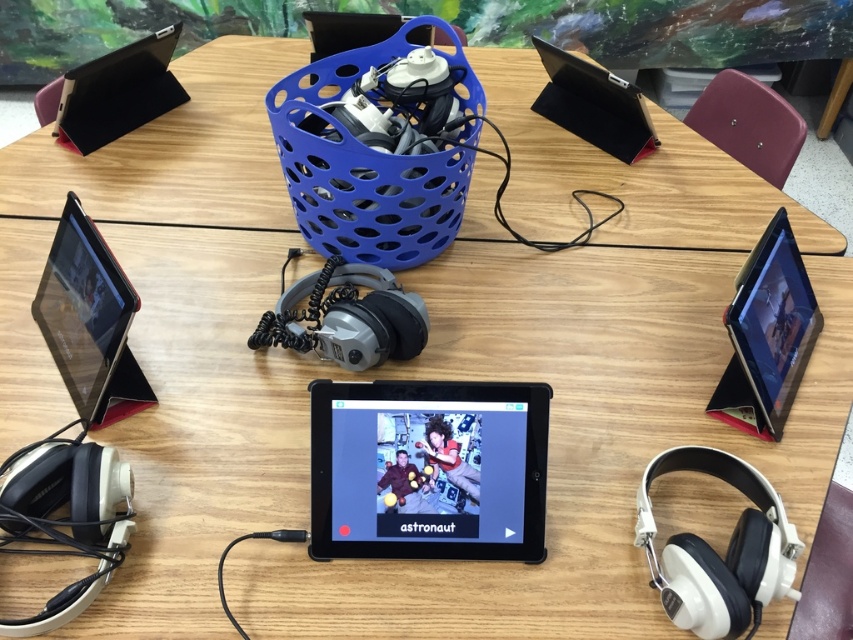
You are standing at the edge of the table looking towards the center. There are two points marked on the table surface labeled point (717, 470) and point (735, 346). Which point is closer to your current position?

Point (717, 470) is closer to the camera than point (735, 346), so the point closer to your current position is point (717, 470).